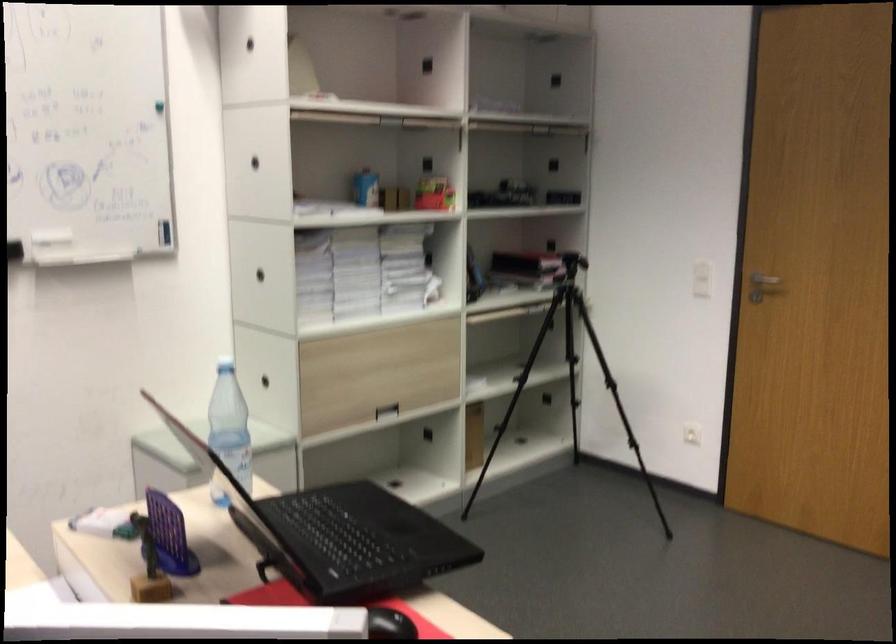
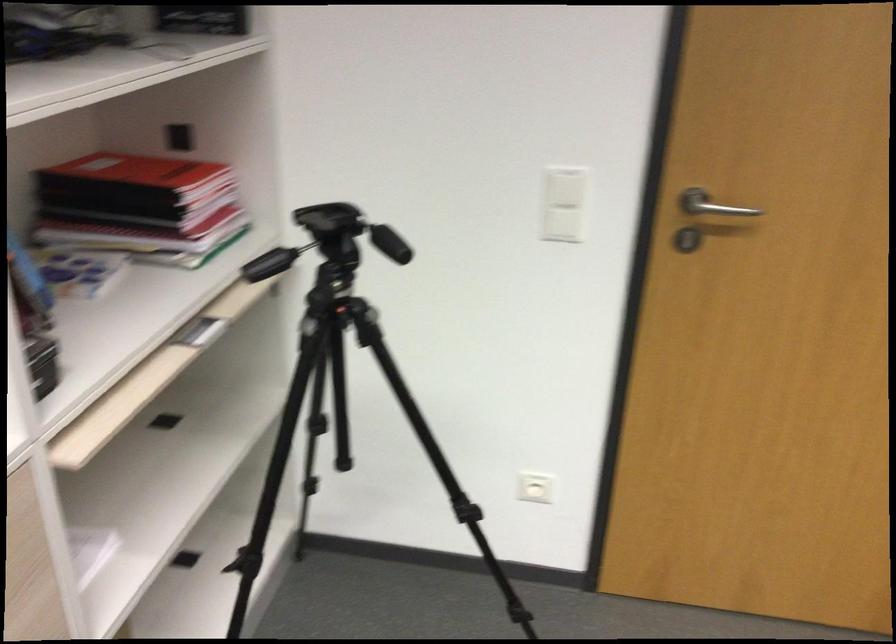
In the second image, find the point that corresponds to (x=717, y=267) in the first image.

(565, 187)